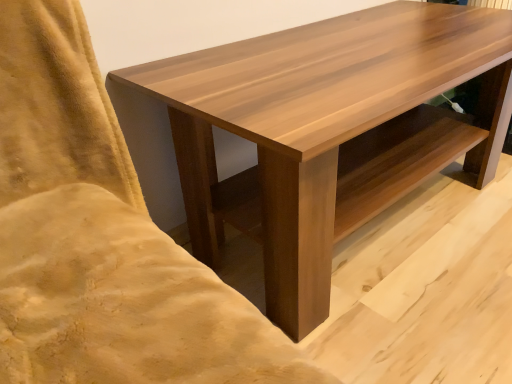
Find the location of a particular element. Image resolution: width=512 pixels, height=384 pixels. satin wood table at center is located at coordinates (320, 123).

The height and width of the screenshot is (384, 512). Describe the element at coordinates (320, 123) in the screenshot. I see `satin wood table at center` at that location.

Where is `satin wood table at center`? This screenshot has width=512, height=384. satin wood table at center is located at coordinates (320, 123).